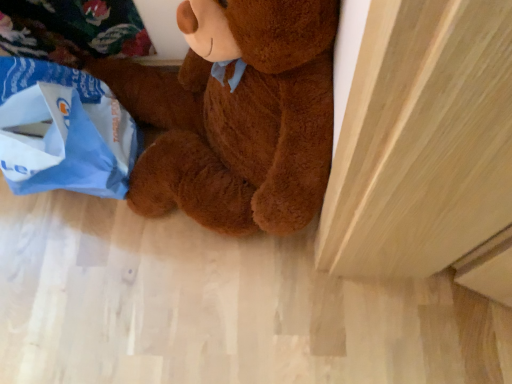
Question: From a real-world perspective, is brown plush teddy bear at center positioned under blue paper grocery bag at lower left based on gravity?

Choices:
 (A) yes
 (B) no

Answer: (B)

Question: Can you confirm if brown plush teddy bear at center is thinner than blue paper grocery bag at lower left?

Choices:
 (A) yes
 (B) no

Answer: (B)

Question: Can you confirm if brown plush teddy bear at center is smaller than blue paper grocery bag at lower left?

Choices:
 (A) yes
 (B) no

Answer: (B)

Question: Are brown plush teddy bear at center and blue paper grocery bag at lower left far apart?

Choices:
 (A) no
 (B) yes

Answer: (A)

Question: Is brown plush teddy bear at center positioned before blue paper grocery bag at lower left?

Choices:
 (A) no
 (B) yes

Answer: (B)

Question: Is brown plush teddy bear at center to the left of blue paper grocery bag at lower left from the viewer's perspective?

Choices:
 (A) no
 (B) yes

Answer: (A)

Question: Is there a large distance between blue paper grocery bag at lower left and brown plush teddy bear at center?

Choices:
 (A) yes
 (B) no

Answer: (B)

Question: From the image's perspective, does blue paper grocery bag at lower left appear lower than brown plush teddy bear at center?

Choices:
 (A) yes
 (B) no

Answer: (A)

Question: Is blue paper grocery bag at lower left closer to the viewer compared to brown plush teddy bear at center?

Choices:
 (A) no
 (B) yes

Answer: (A)

Question: Is blue paper grocery bag at lower left positioned with its back to brown plush teddy bear at center?

Choices:
 (A) no
 (B) yes

Answer: (A)

Question: From a real-world perspective, does blue paper grocery bag at lower left sit lower than brown plush teddy bear at center?

Choices:
 (A) no
 (B) yes

Answer: (B)

Question: Considering the relative sizes of blue paper grocery bag at lower left and brown plush teddy bear at center in the image provided, is blue paper grocery bag at lower left smaller than brown plush teddy bear at center?

Choices:
 (A) no
 (B) yes

Answer: (B)

Question: From the image's perspective, relative to blue paper grocery bag at lower left, is brown plush teddy bear at center above or below?

Choices:
 (A) below
 (B) above

Answer: (B)